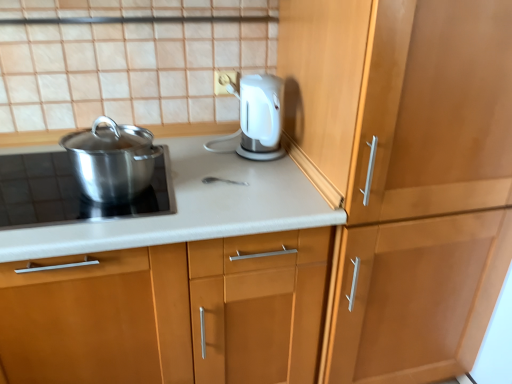
Question: Which direction should I rotate to look at matte white countertop at center, arranged as the 1th cabinetry when viewed from the left, — up or down?

Choices:
 (A) down
 (B) up

Answer: (A)

Question: From the image's perspective, does matte white countertop at center, the second cabinetry when ordered from right to left, appear lower than wooden cabinet at right, the 1th cabinetry viewed from the right?

Choices:
 (A) no
 (B) yes

Answer: (B)

Question: Is wooden cabinet at right, the 1th cabinetry viewed from the right, completely or partially inside matte white countertop at center, arranged as the 1th cabinetry when viewed from the left?

Choices:
 (A) yes
 (B) no

Answer: (B)

Question: Is matte white countertop at center, arranged as the 1th cabinetry when viewed from the left, at the left side of wooden cabinet at right, marked as the second cabinetry in a left-to-right arrangement?

Choices:
 (A) yes
 (B) no

Answer: (A)

Question: Can you see matte white countertop at center, the second cabinetry when ordered from right to left, touching wooden cabinet at right, marked as the second cabinetry in a left-to-right arrangement?

Choices:
 (A) yes
 (B) no

Answer: (B)

Question: Can we say matte white countertop at center, the second cabinetry when ordered from right to left, lies outside wooden cabinet at right, marked as the second cabinetry in a left-to-right arrangement?

Choices:
 (A) yes
 (B) no

Answer: (A)

Question: Is matte white countertop at center, arranged as the 1th cabinetry when viewed from the left, shorter than wooden cabinet at right, the 1th cabinetry viewed from the right?

Choices:
 (A) yes
 (B) no

Answer: (A)

Question: Does polished stainless steel pot at left have a lesser width compared to wooden cabinet at right, marked as the second cabinetry in a left-to-right arrangement?

Choices:
 (A) yes
 (B) no

Answer: (A)

Question: Can you confirm if polished stainless steel pot at left is smaller than wooden cabinet at right, marked as the second cabinetry in a left-to-right arrangement?

Choices:
 (A) yes
 (B) no

Answer: (A)

Question: Is polished stainless steel pot at left to the left of wooden cabinet at right, the 1th cabinetry viewed from the right, from the viewer's perspective?

Choices:
 (A) no
 (B) yes

Answer: (B)

Question: Considering the relative positions of polished stainless steel pot at left and wooden cabinet at right, marked as the second cabinetry in a left-to-right arrangement, in the image provided, is polished stainless steel pot at left behind wooden cabinet at right, marked as the second cabinetry in a left-to-right arrangement,?

Choices:
 (A) no
 (B) yes

Answer: (B)

Question: Is polished stainless steel pot at left taller than wooden cabinet at right, marked as the second cabinetry in a left-to-right arrangement?

Choices:
 (A) yes
 (B) no

Answer: (B)

Question: From the image's perspective, is polished stainless steel pot at left on top of wooden cabinet at right, marked as the second cabinetry in a left-to-right arrangement?

Choices:
 (A) no
 (B) yes

Answer: (B)

Question: Is polished stainless steel pot at left taller than wooden cabinet at right, the 1th cabinetry viewed from the right?

Choices:
 (A) no
 (B) yes

Answer: (A)